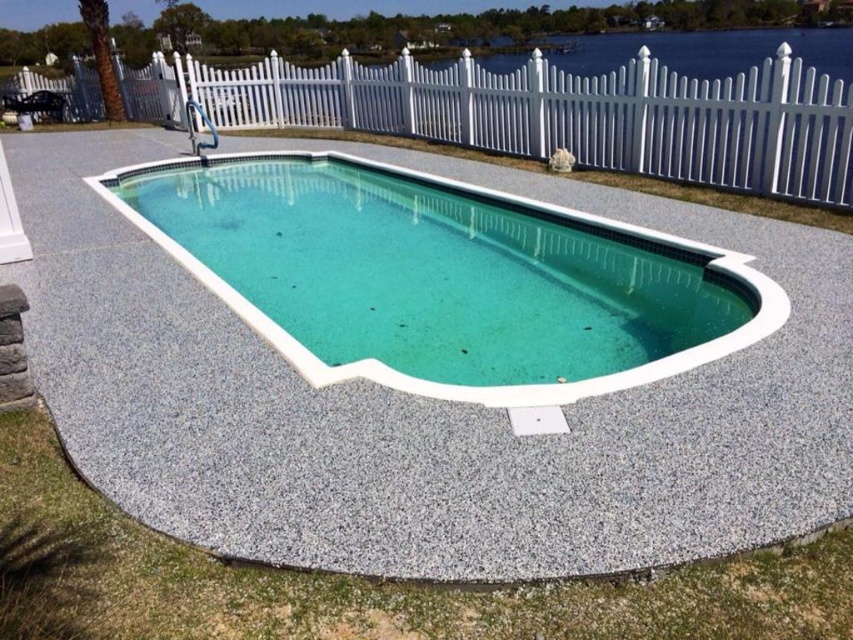
Who is more distant from viewer, (x=125, y=83) or (x=726, y=264)?

The point (x=125, y=83) is more distant.

Between white plastic fence at upper center and clear acrylic pool at center, which one appears on the right side from the viewer's perspective?

Positioned to the right is clear acrylic pool at center.

Who is more distant from viewer, [550,113] or [714,358]?

Positioned behind is point [550,113].

Identify the location of white plastic fence at upper center. This screenshot has height=640, width=853. (547, 113).